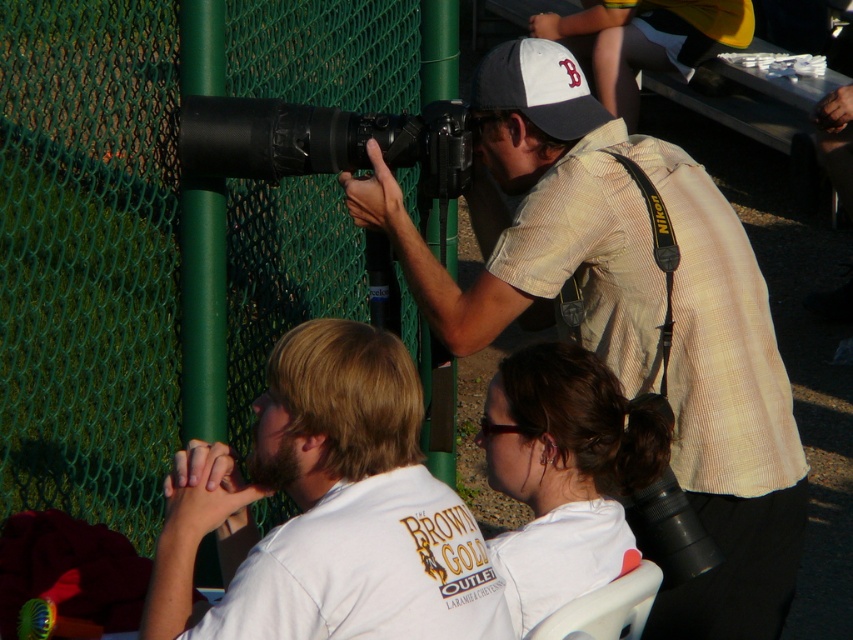
Question: Based on their relative distances, which object is nearer to the green mesh fence at left?

Choices:
 (A) white fabric baseball cap at center
 (B) black matte camera at center
 (C) white cotton shirt at center

Answer: (B)

Question: Estimate the real-world distances between objects in this image. Which object is closer to the matte white shirt at center?

Choices:
 (A) matte khaki shirt at center
 (B) black matte camera at center

Answer: (A)

Question: Can you confirm if white cotton shirt at center is positioned to the right of black matte camera at center?

Choices:
 (A) yes
 (B) no

Answer: (A)

Question: Considering the real-world distances, which object is closest to the green mesh fence at left?

Choices:
 (A) white cotton shirt at center
 (B) matte white shirt at center
 (C) black matte camera at center
 (D) white fabric baseball cap at center

Answer: (C)

Question: Can you confirm if green mesh fence at left is wider than matte white shirt at center?

Choices:
 (A) yes
 (B) no

Answer: (A)

Question: In this image, where is green mesh fence at left located relative to white cotton shirt at center?

Choices:
 (A) below
 (B) above

Answer: (B)